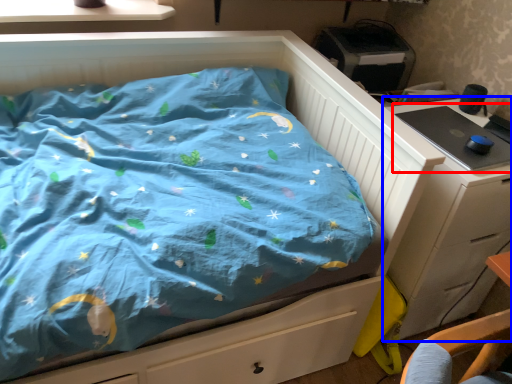
Question: Among these objects, which one is nearest to the camera, desktop (highlighted by a red box) or chest of drawers (highlighted by a blue box)?

Choices:
 (A) desktop
 (B) chest of drawers

Answer: (B)